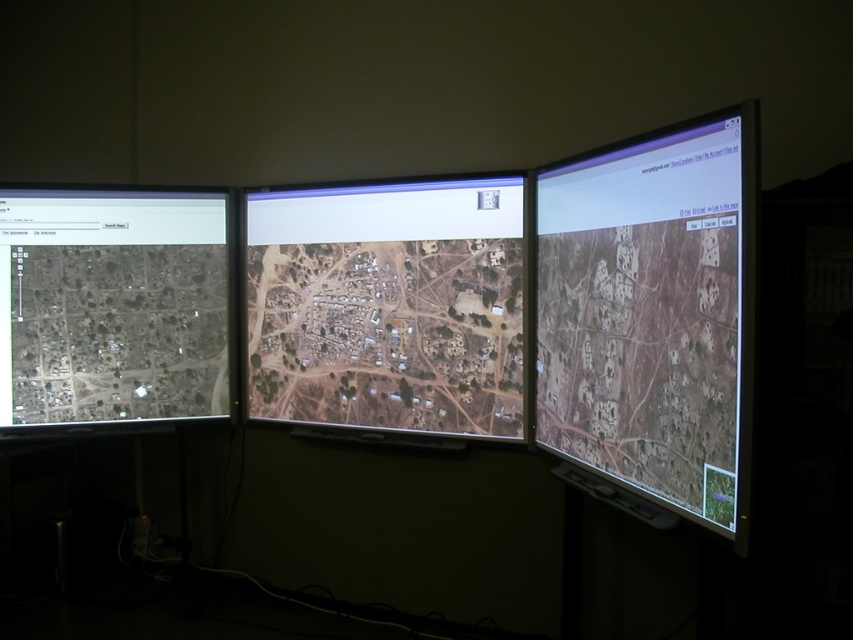
Can you confirm if matte black monitor at right is positioned below satellite imagery map at center?

Yes.

Can you confirm if matte black monitor at right is smaller than satellite imagery map at center?

Yes.

Image resolution: width=853 pixels, height=640 pixels. Describe the element at coordinates (653, 314) in the screenshot. I see `matte black monitor at right` at that location.

This screenshot has width=853, height=640. Identify the location of matte black monitor at right. (653, 314).

Can you confirm if satellite imagery map at center is positioned above gray matte map at left?

Incorrect, satellite imagery map at center is not positioned above gray matte map at left.

At what (x,y) coordinates should I click in order to perform the action: click on satellite imagery map at center. Please return your answer as a coordinate pair (x, y). Looking at the image, I should click on (387, 305).

Which is more to the left, matte black monitor at right or gray matte map at left?

From the viewer's perspective, gray matte map at left appears more on the left side.

Can you confirm if matte black monitor at right is thinner than gray matte map at left?

Indeed, matte black monitor at right has a lesser width compared to gray matte map at left.

Is point (654, 152) farther from viewer compared to point (155, 259)?

No, (654, 152) is closer to viewer.

Image resolution: width=853 pixels, height=640 pixels. In order to click on matte black monitor at right in this screenshot , I will do `click(653, 314)`.